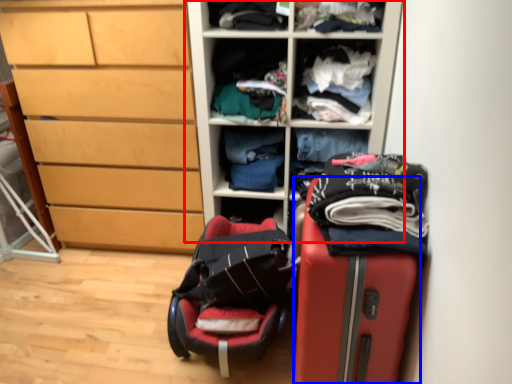
Question: Among these objects, which one is farthest to the camera, cupboard (highlighted by a red box) or suitcase (highlighted by a blue box)?

Choices:
 (A) cupboard
 (B) suitcase

Answer: (A)